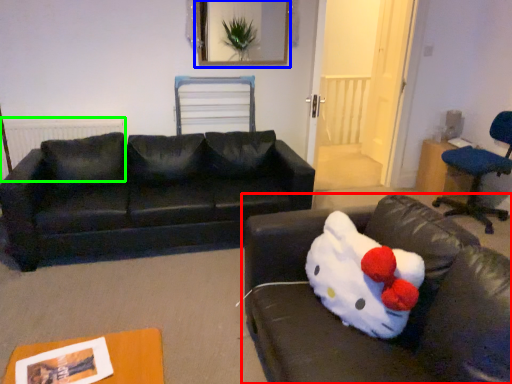
Question: Estimate the real-world distances between objects in this image. Which object is farther from studio couch (highlighted by a red box), picture frame (highlighted by a blue box) or radiator (highlighted by a green box)?

Choices:
 (A) picture frame
 (B) radiator

Answer: (A)